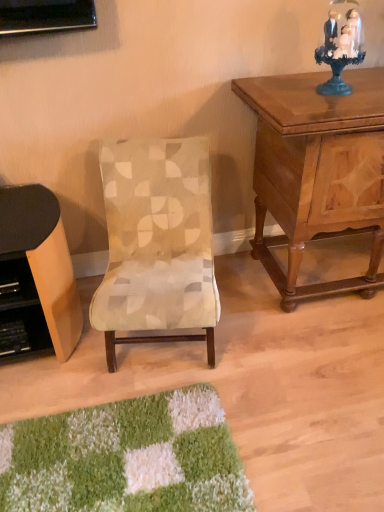
Question: From a real-world perspective, is blue glass figurine at upper right above or below beige fabric chair at center?

Choices:
 (A) above
 (B) below

Answer: (A)

Question: Considering the relative positions of blue glass figurine at upper right and beige fabric chair at center in the image provided, is blue glass figurine at upper right to the left or to the right of beige fabric chair at center?

Choices:
 (A) left
 (B) right

Answer: (B)

Question: Estimate the real-world distances between objects in this image. Which object is closer to the beige fabric chair at center?

Choices:
 (A) light brown wood desk at left
 (B) blue glass figurine at upper right
 (C) wooden nightstand at upper right

Answer: (A)

Question: Estimate the real-world distances between objects in this image. Which object is farther from the light brown wood desk at left?

Choices:
 (A) beige fabric chair at center
 (B) wooden nightstand at upper right
 (C) blue glass figurine at upper right

Answer: (C)